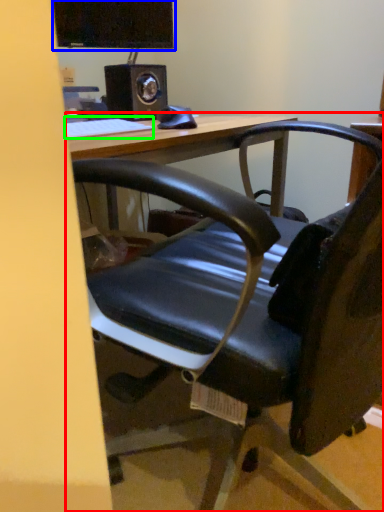
Question: Based on their relative distances, which object is farther from table (highlighted by a red box)? Choose from computer monitor (highlighted by a blue box) and keyboard (highlighted by a green box).

Choices:
 (A) computer monitor
 (B) keyboard

Answer: (A)